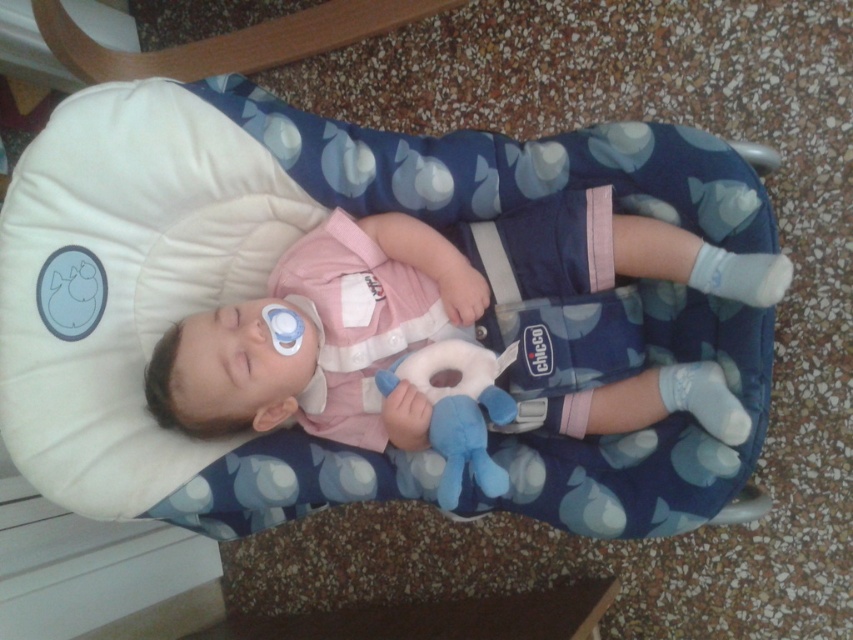
What are the coordinates of the blue fabric infant bed at center?

The blue fabric infant bed at center is located at point (258,272).

You are a photographer taking a picture of the baby in the bouncer. You need to focus on either the point at coordinate point (x=68, y=160) or the point at coordinate point (x=434, y=442). Which point should you choose to ensure the baby is in focus?

You should focus on point (x=68, y=160) because it is closer to the viewer than point (x=434, y=442), so focusing there will ensure the baby is in focus.